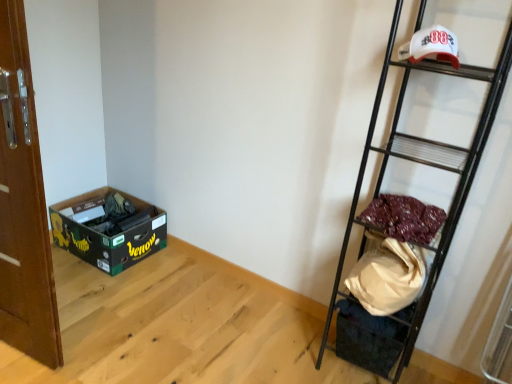
This screenshot has height=384, width=512. In order to click on vacant space in between black metal ladder at right and green cardboard box at lower left in this screenshot , I will do `click(219, 303)`.